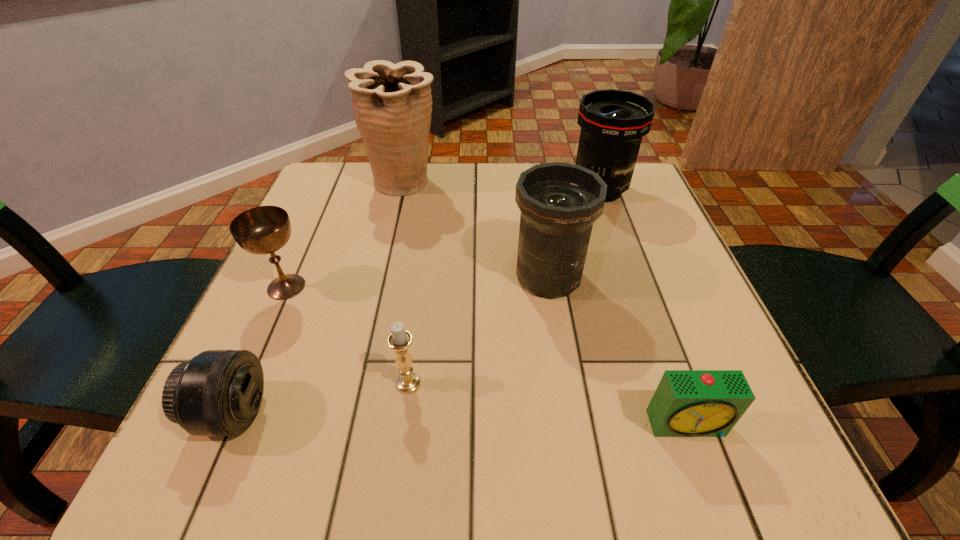
Where is `chalice that is positioned at the left edge`? The image size is (960, 540). chalice that is positioned at the left edge is located at coordinates (261, 230).

Locate an element on the screen. telephoto lens situated at the left edge is located at coordinates (218, 392).

At what (x,y) coordinates should I click in order to perform the action: click on telephoto lens that is at the right edge. Please return your answer as a coordinate pair (x, y). The width and height of the screenshot is (960, 540). Looking at the image, I should click on (613, 122).

Where is `alarm clock at the right edge`? The image size is (960, 540). alarm clock at the right edge is located at coordinates (687, 403).

Where is `object present at the far left corner`? This screenshot has height=540, width=960. object present at the far left corner is located at coordinates (392, 103).

Locate an element on the screen. This screenshot has width=960, height=540. object at the near left corner is located at coordinates (218, 392).

You are a GUI agent. You are given a task and a screenshot of the screen. Output one action in this format:
    pyautogui.click(x=<x>, y=<y>)
    Task: Click on the object at the far right corner
    This screenshot has height=540, width=960.
    Given the screenshot: What is the action you would take?
    pyautogui.click(x=613, y=122)

Where is `object located at the near right corner`? object located at the near right corner is located at coordinates (687, 403).

Find the location of a particular element. free space at the far edge of the desktop is located at coordinates (447, 167).

At what (x,y) coordinates should I click in order to perform the action: click on vacant point at the near edge. Please return your answer as a coordinate pair (x, y). Looking at the image, I should click on (388, 418).